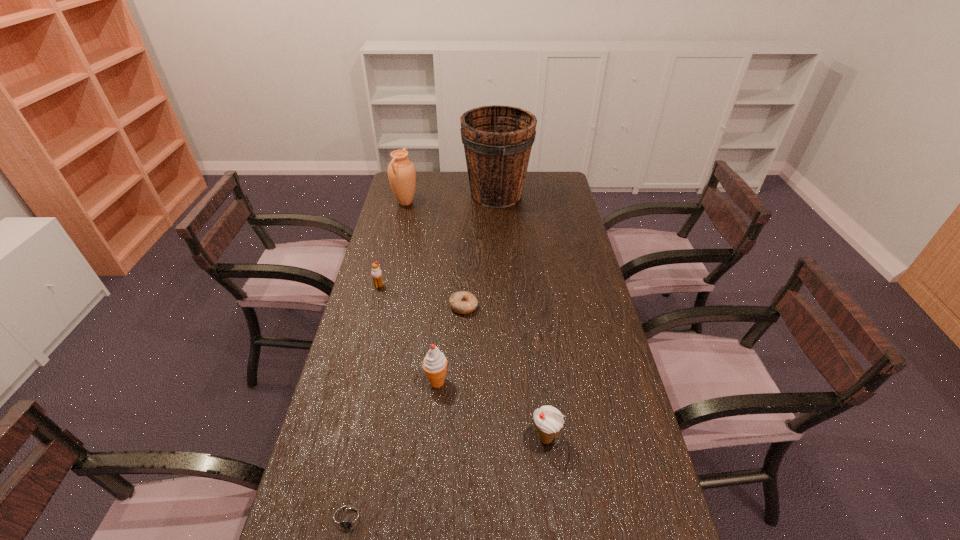
Find the location of a particular element. The width and height of the screenshot is (960, 540). bucket is located at coordinates (497, 139).

Locate an element on the screen. The height and width of the screenshot is (540, 960). the sixth shortest object is located at coordinates (401, 172).

Identify the location of the second icecream from right to left. The height and width of the screenshot is (540, 960). (434, 364).

Locate an element on the screen. This screenshot has height=540, width=960. the second farthest icecream is located at coordinates (434, 364).

What are the coordinates of `the rightmost icecream` in the screenshot? It's located at tap(549, 421).

Find the location of a particular element. This screenshot has width=960, height=540. the nearest icecream is located at coordinates (549, 421).

This screenshot has height=540, width=960. What are the coordinates of `the farthest icecream` in the screenshot? It's located at (376, 273).

I want to click on the fifth tallest object, so click(376, 273).

Where is `the sixth tallest object`? This screenshot has width=960, height=540. the sixth tallest object is located at coordinates (462, 302).

Locate an element on the screen. The height and width of the screenshot is (540, 960). the fourth nearest object is located at coordinates (462, 302).